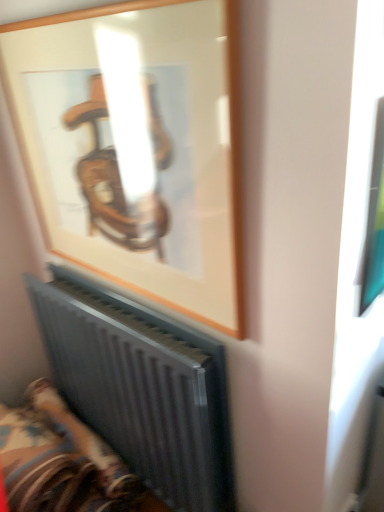
Identify the location of metallic gray radiator at lower left. (141, 387).

What do you see at coordinates (137, 146) in the screenshot?
I see `wooden frame at upper center` at bounding box center [137, 146].

The width and height of the screenshot is (384, 512). What are the coordinates of `metallic radiator at lower left` in the screenshot? It's located at (63, 461).

Looking at this image, from the image's perspective, which one is positioned higher, metallic radiator at lower left or wooden frame at upper center?

wooden frame at upper center appears higher in the image.

Is metallic radiator at lower left taller than wooden frame at upper center?

In fact, metallic radiator at lower left may be shorter than wooden frame at upper center.

Consider the image. Between metallic radiator at lower left and wooden frame at upper center, which one is positioned behind?

metallic radiator at lower left is more distant.

You are a GUI agent. You are given a task and a screenshot of the screen. Output one action in this format:
    pyautogui.click(x=<x>, y=<y>)
    Task: Click on the furniture behind the wooden frame at upper center
    This screenshot has width=384, height=512.
    Given the screenshot: What is the action you would take?
    pyautogui.click(x=63, y=461)

Is wooden frame at upper center not close to metallic radiator at lower left?

wooden frame at upper center is actually quite close to metallic radiator at lower left.

Does wooden frame at upper center contain metallic radiator at lower left?

No, metallic radiator at lower left is not inside wooden frame at upper center.

In the scene shown: From a real-world perspective, between wooden frame at upper center and metallic radiator at lower left, who is vertically lower?

metallic radiator at lower left, from a real-world perspective.

Does wooden frame at upper center come behind metallic radiator at lower left?

No.

From a real-world perspective, which is physically above, metallic gray radiator at lower left or wooden frame at upper center?

Answer: From a 3D spatial view, wooden frame at upper center is above.

Considering the positions of objects metallic gray radiator at lower left and wooden frame at upper center in the image provided, who is more to the right, metallic gray radiator at lower left or wooden frame at upper center?

metallic gray radiator at lower left.

Does point (199, 403) come in front of point (179, 262)?

That is True.

From a real-world perspective, is metallic radiator at lower left positioned under metallic gray radiator at lower left based on gravity?

Correct, in the physical world, metallic radiator at lower left is lower than metallic gray radiator at lower left.

Between metallic radiator at lower left and metallic gray radiator at lower left, which one has larger size?

metallic radiator at lower left.

Which point is more distant from viewer, (67,433) or (181,490)?

Positioned behind is point (67,433).

Which object is wider, metallic radiator at lower left or metallic gray radiator at lower left?

With larger width is metallic radiator at lower left.

Which is nearer, (125, 432) or (26, 416)?

The point (125, 432) is more forward.

Locate an element on the screen. This screenshot has width=384, height=512. radiator on the right of metallic radiator at lower left is located at coordinates (141, 387).

In terms of width, does metallic gray radiator at lower left look wider or thinner when compared to metallic radiator at lower left?

metallic gray radiator at lower left is thinner than metallic radiator at lower left.

Considering the positions of objects metallic gray radiator at lower left and metallic radiator at lower left in the image provided, who is more to the left, metallic gray radiator at lower left or metallic radiator at lower left?

From the viewer's perspective, metallic radiator at lower left appears more on the left side.

Measure the distance between wooden frame at upper center and metallic gray radiator at lower left.

wooden frame at upper center and metallic gray radiator at lower left are 14.60 inches apart.

Which object is thinner, wooden frame at upper center or metallic gray radiator at lower left?

Thinner between the two is wooden frame at upper center.

From their relative heights in the image, would you say wooden frame at upper center is taller or shorter than metallic gray radiator at lower left?

Clearly, wooden frame at upper center is shorter compared to metallic gray radiator at lower left.

Is metallic gray radiator at lower left a part of wooden frame at upper center?

No, metallic gray radiator at lower left is not inside wooden frame at upper center.

I want to click on furniture below the wooden frame at upper center (from the image's perspective), so click(63, 461).

Locate an element on the screen. The height and width of the screenshot is (512, 384). picture frame that appears above the metallic radiator at lower left (from a real-world perspective) is located at coordinates (137, 146).

From the image, which object appears to be farther from metallic radiator at lower left, wooden frame at upper center or metallic gray radiator at lower left?

wooden frame at upper center.

Looking at the image, which one is located further to metallic gray radiator at lower left, wooden frame at upper center or metallic radiator at lower left?

wooden frame at upper center is further to metallic gray radiator at lower left.

Estimate the real-world distances between objects in this image. Which object is closer to wooden frame at upper center, metallic radiator at lower left or metallic gray radiator at lower left?

Based on the image, metallic gray radiator at lower left appears to be nearer to wooden frame at upper center.

Consider the image. Based on their spatial positions, is metallic gray radiator at lower left or metallic radiator at lower left closer to wooden frame at upper center?

metallic gray radiator at lower left is closer to wooden frame at upper center.

From the image, which object appears to be farther from metallic radiator at lower left, metallic gray radiator at lower left or wooden frame at upper center?

wooden frame at upper center.

Based on the photo, when comparing their distances from metallic gray radiator at lower left, does metallic radiator at lower left or wooden frame at upper center seem further?

Based on the image, wooden frame at upper center appears to be further to metallic gray radiator at lower left.

Locate an element on the screen. radiator between wooden frame at upper center and metallic radiator at lower left in the vertical direction is located at coordinates (141, 387).